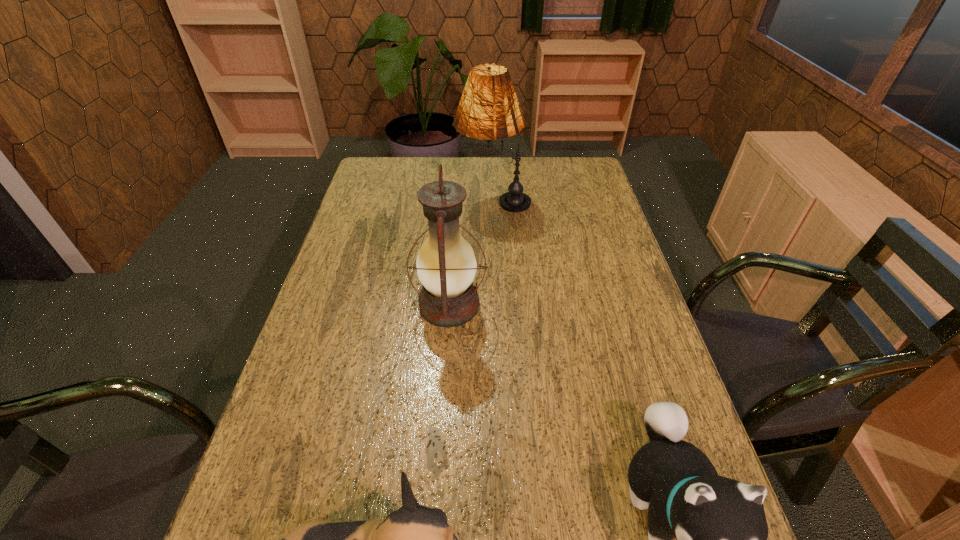
You are a GUI agent. You are given a task and a screenshot of the screen. Output one action in this format:
    pyautogui.click(x=<x>, y=<y>)
    Task: Click on the farthest object
    The image size is (960, 540).
    Given the screenshot: What is the action you would take?
    pyautogui.click(x=488, y=109)

Find the location of `oil lamp`. oil lamp is located at coordinates (446, 265).

Locate an element on the screen. This screenshot has width=960, height=540. free space located 0.340m on the front-facing side of the farthest object is located at coordinates (359, 200).

Where is `vacant space situated 0.080m on the front-facing side of the farthest object`? The width and height of the screenshot is (960, 540). vacant space situated 0.080m on the front-facing side of the farthest object is located at coordinates (433, 200).

Locate an element on the screen. This screenshot has width=960, height=540. vacant space located on the front-facing side of the farthest object is located at coordinates (404, 200).

Locate an element on the screen. The image size is (960, 540). free space located on the left of the second farthest object is located at coordinates (319, 305).

Identify the location of object that is at the far edge. (488, 109).

Image resolution: width=960 pixels, height=540 pixels. In the image, there is a desktop. In order to click on vacant space at the far edge in this screenshot , I will do `click(524, 159)`.

This screenshot has height=540, width=960. In the image, there is a desktop. Find the location of `blank space at the left edge`. blank space at the left edge is located at coordinates (357, 257).

Locate an element on the screen. free space at the right edge is located at coordinates (611, 247).